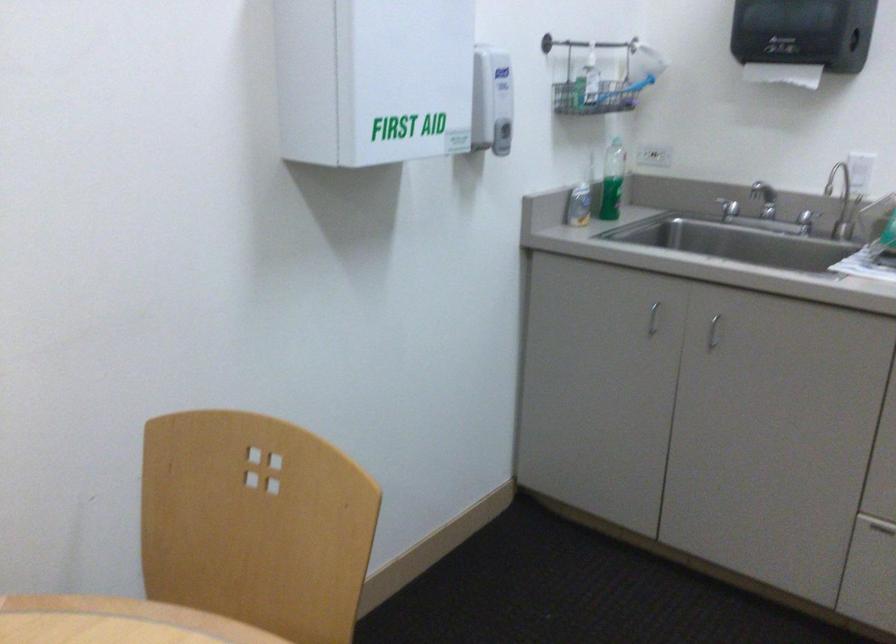
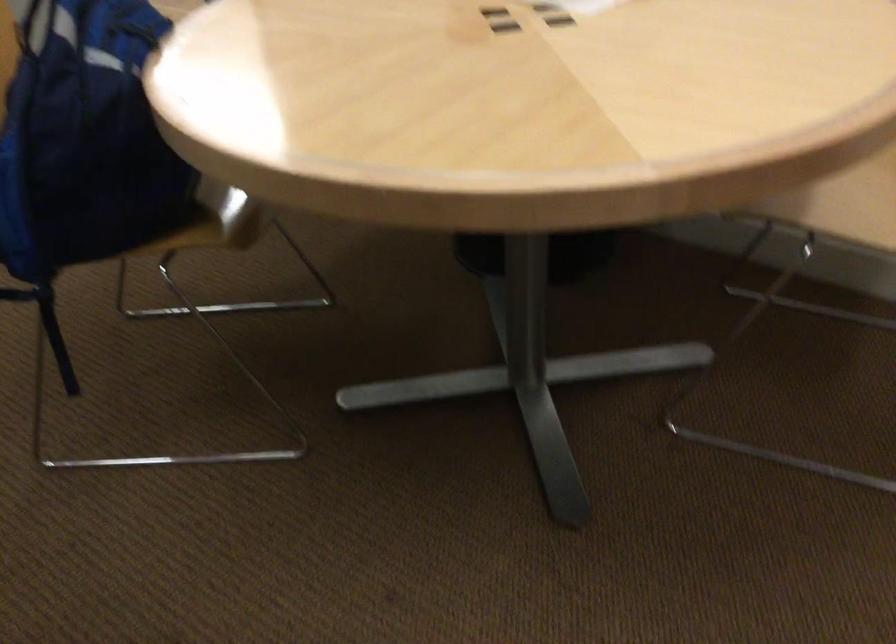
From the picture: How did the camera likely rotate?

The camera's rotation is toward left-down.